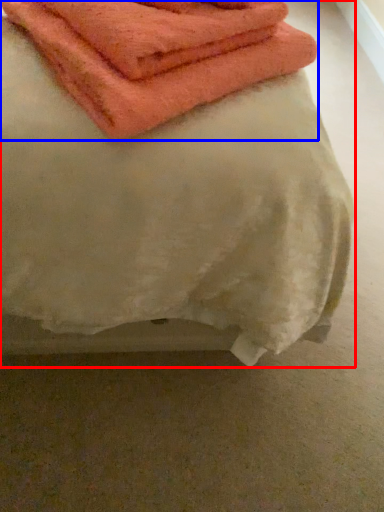
Question: Which of the following is the closest to the observer, towel (highlighted by a red box) or towel (highlighted by a blue box)?

Choices:
 (A) towel
 (B) towel

Answer: (A)